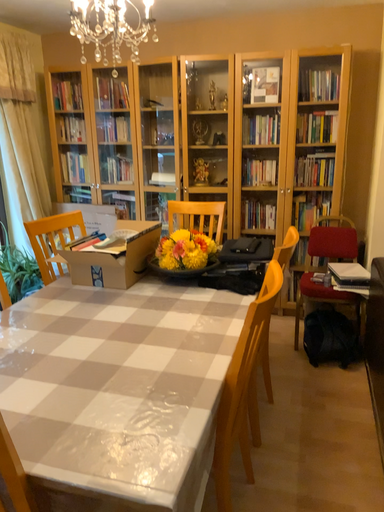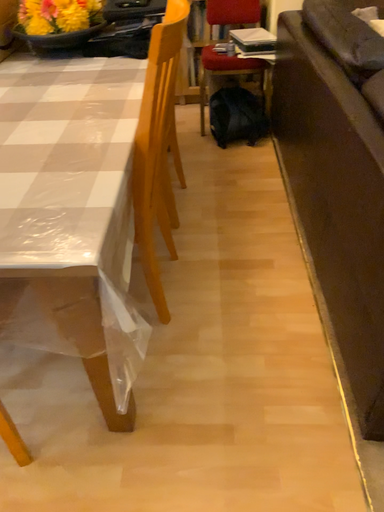
Question: How did the camera likely rotate when shooting the video?

Choices:
 (A) rotated upward
 (B) rotated downward

Answer: (B)